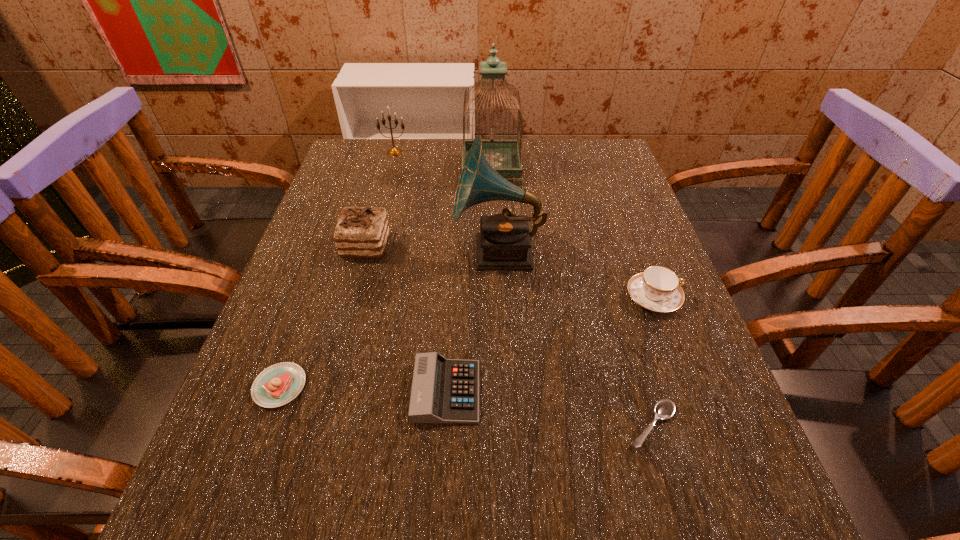
This screenshot has height=540, width=960. What are the coordinates of `vacant space located 0.320m at the door of the tallest object` in the screenshot? It's located at (348, 169).

Locate an element on the screen. vacant space located 0.280m from the horn of the second tallest object is located at coordinates (330, 252).

Locate an element on the screen. The height and width of the screenshot is (540, 960). vacant space located from the horn of the second tallest object is located at coordinates (325, 252).

You are a GUI agent. You are given a task and a screenshot of the screen. Output one action in this format:
    pyautogui.click(x=<x>, y=<y>)
    Task: Click on the vacant space located 0.160m from the horn of the second tallest object
    This screenshot has width=960, height=540.
    Given the screenshot: What is the action you would take?
    click(383, 252)

Locate an element on the screen. The image size is (960, 540). vacant space located on the front of the third tallest object is located at coordinates (382, 198).

Find the location of a particular element. blank area located 0.190m on the right of the chocolate cake is located at coordinates (471, 246).

The height and width of the screenshot is (540, 960). Identify the location of free region located on the back of the calculator. (456, 231).

Locate an element on the screen. free space located 0.280m on the back of the second shortest object is located at coordinates (326, 258).

Where is `vacant space situated 0.390m on the left of the shortest object`? vacant space situated 0.390m on the left of the shortest object is located at coordinates (378, 426).

Locate an element on the screen. birdcage at the far edge is located at coordinates (504, 156).